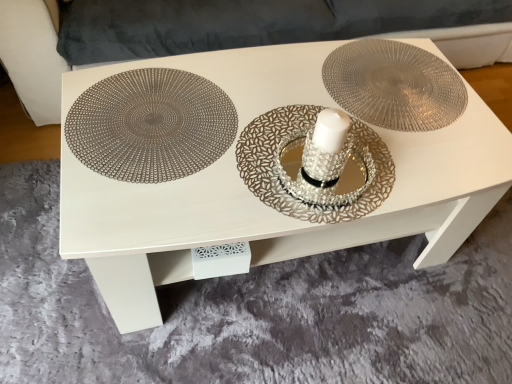
Where is `vacant space in between silver textured plate at center and metallic woven placemat at left`? This screenshot has width=512, height=384. vacant space in between silver textured plate at center and metallic woven placemat at left is located at coordinates (231, 142).